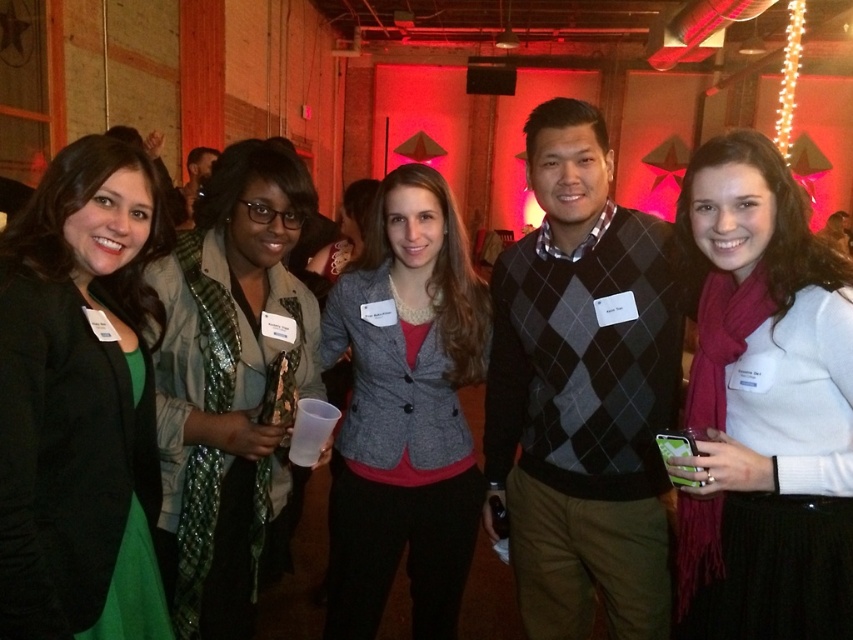
You are a photographer at the event and need to take a photo of the green matte blazer at left without the camera appearing in the frame. Given their distance apart, is this possible?

The green matte blazer at left and camera are 3.46 feet apart from each other, so yes, the photographer can position themselves to capture the blazer without the camera appearing in the frame since they are sufficiently distant.

You are standing in the middle of the room and want to move towards the two points marked in the image. Which point, point (567, 236) or point (120, 529), will you reach first?

Point (567, 236) is further to the viewer than point (120, 529), so you will reach point (567, 236) first.